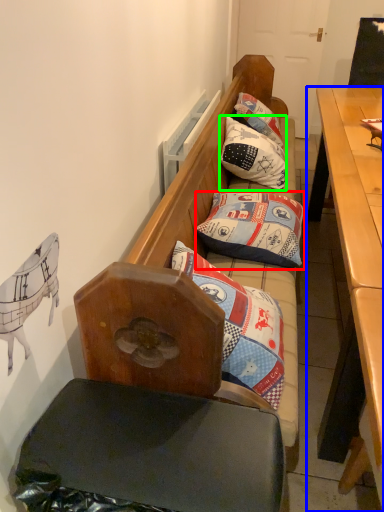
Question: Based on their relative distances, which object is nearer to pillow (highlighted by a red box)? Choose from desk (highlighted by a blue box) and pillow (highlighted by a green box).

Choices:
 (A) desk
 (B) pillow

Answer: (A)